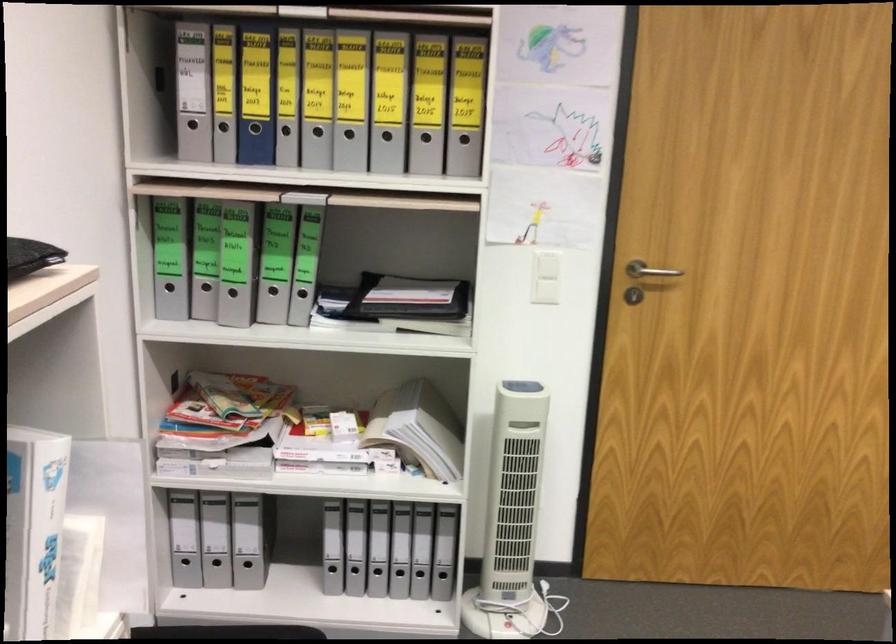
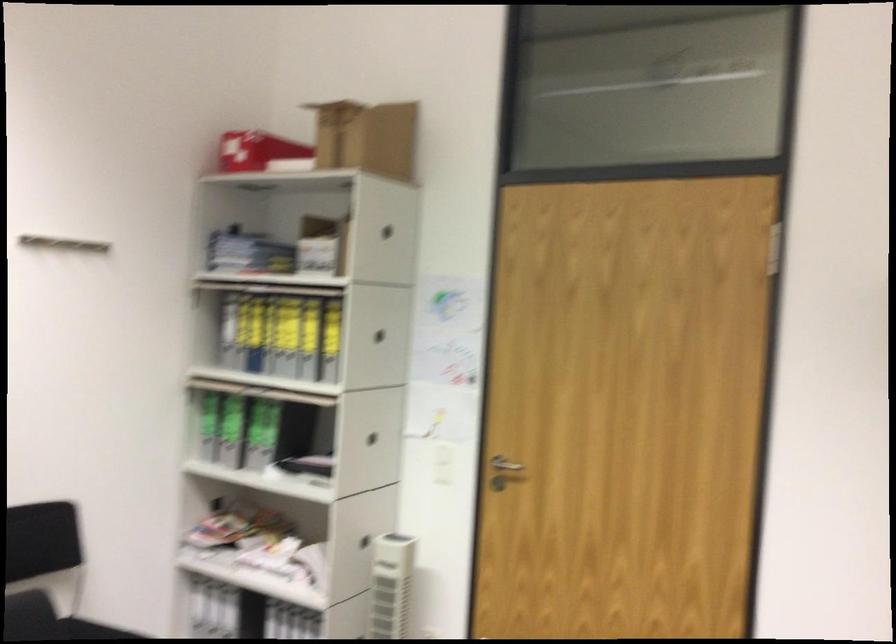
Locate, in the second image, the point that corresponds to point (346, 140) in the first image.

(289, 359)